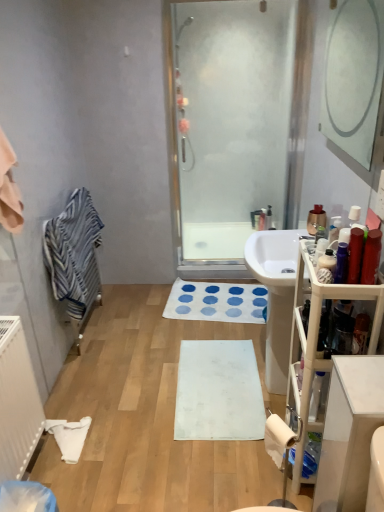
Looking at this image, measure the distance between clear glass mirror at upper right and camera.

The distance of clear glass mirror at upper right from camera is 3.00 meters.

Image resolution: width=384 pixels, height=512 pixels. What do you see at coordinates (74, 253) in the screenshot?
I see `blue striped towel at left` at bounding box center [74, 253].

This screenshot has width=384, height=512. Describe the element at coordinates (316, 219) in the screenshot. I see `gold metallic cup at right, the 5th toiletry when ordered from front to back` at that location.

What is the approximate height of gold metallic cup at right, the first toiletry positioned from the back?

gold metallic cup at right, the first toiletry positioned from the back, is 4.91 inches tall.

In order to face white matte rug at center, should I rotate leftwards or rightwards?

To face it directly, rotate left by 2.460 degrees.

What do you see at coordinates (148, 417) in the screenshot? I see `white matte rug at center` at bounding box center [148, 417].

You are a GUI agent. You are given a task and a screenshot of the screen. Output one action in this format:
    pyautogui.click(x=<x>, y=<y>)
    Task: Click on the white fabric bath mat at center, arranged as the first bath mat when viewed from the back
    Image resolution: width=384 pixels, height=512 pixels.
    Given the screenshot: What is the action you would take?
    pyautogui.click(x=216, y=302)

Identify the location of clear glass mirror at upper right. Image resolution: width=384 pixels, height=512 pixels. (353, 77).

What's the angular difference between white glossy sink at center and white matte bath mat at center, the second bath mat viewed from the top,'s facing directions?

They differ by 3.37 degrees in their facing directions.

Which object is more forward, white glossy sink at center or white matte bath mat at center, the second bath mat viewed from the top?

white glossy sink at center is more forward.

Between white glossy sink at center and white matte bath mat at center, which is counted as the 2th bath mat, starting from the back, which one has smaller size?

Smaller between the two is white matte bath mat at center, which is counted as the 2th bath mat, starting from the back.

Does white glossy sink at center turn towards white matte bath mat at center, the second bath mat viewed from the top?

Yes, white glossy sink at center is facing white matte bath mat at center, the second bath mat viewed from the top.

Consider the image. Is gold metallic cup at right, the first toiletry positioned from the back, positioned with its back to white glossy cabinet at right?

gold metallic cup at right, the first toiletry positioned from the back, does not have its back to white glossy cabinet at right.

Consider the image. Based on their positions, is gold metallic cup at right, the 5th toiletry when ordered from front to back, located to the left or right of white glossy cabinet at right?

gold metallic cup at right, the 5th toiletry when ordered from front to back, is positioned on white glossy cabinet at right's right side.

From a real-world perspective, is gold metallic cup at right, the first toiletry when ordered from right to left, positioned under white glossy cabinet at right based on gravity?

Incorrect, from a real-world perspective, gold metallic cup at right, the first toiletry when ordered from right to left, is higher than white glossy cabinet at right.

Is gold metallic cup at right, the first toiletry when ordered from right to left, inside or outside of white glossy cabinet at right?

gold metallic cup at right, the first toiletry when ordered from right to left, is spatially situated outside white glossy cabinet at right.

From a real-world perspective, which object stands above the other?

From a 3D spatial view, transparent glass shower door at center is above.

Would you say white matte toilet paper at lower right contains transparent glass shower door at center?

No, transparent glass shower door at center is located outside of white matte toilet paper at lower right.

Considering the relative positions of white matte toilet paper at lower right and transparent glass shower door at center in the image provided, is white matte toilet paper at lower right behind transparent glass shower door at center?

No, white matte toilet paper at lower right is in front of transparent glass shower door at center.

From the picture: From a real-world perspective, who is located higher, transparent glass shower door at center or white glossy sink at center?

transparent glass shower door at center, from a real-world perspective.

Which of these two, transparent glass shower door at center or white glossy sink at center, is smaller?

With smaller size is transparent glass shower door at center.

Who is taller, transparent glass shower door at center or white glossy sink at center?

Standing taller between the two is transparent glass shower door at center.

Considering the positions of objects transparent glass shower door at center and white glossy sink at center in the image provided, who is more to the right, transparent glass shower door at center or white glossy sink at center?

From the viewer's perspective, white glossy sink at center appears more on the right side.

Identify the location of toilet paper above the white radiator at lower left (from the image's perspective). (278, 438).

Does white radiator at lower left appear on the right side of white matte toilet paper at lower right?

Incorrect, white radiator at lower left is not on the right side of white matte toilet paper at lower right.

From a real-world perspective, is white radiator at lower left positioned over white matte toilet paper at lower right based on gravity?

Actually, white radiator at lower left is physically below white matte toilet paper at lower right in the real world.

Which of these two, white radiator at lower left or white matte toilet paper at lower right, is smaller?

With smaller size is white matte toilet paper at lower right.

Based on their positions, is clear glass mirror at upper right located to the left or right of shiny purple bottle at right, the third toiletry viewed from the back?

clear glass mirror at upper right is to the right of shiny purple bottle at right, the third toiletry viewed from the back.

Is clear glass mirror at upper right looking in the opposite direction of shiny purple bottle at right, the 3th toiletry positioned from the front?

That's not correct — clear glass mirror at upper right is not looking away from shiny purple bottle at right, the 3th toiletry positioned from the front.

Image resolution: width=384 pixels, height=512 pixels. I want to click on bath above the blue striped towel at left (from the image's perspective), so click(215, 240).

Can you confirm if blue striped towel at left is shorter than translucent glass bathtub at center?

No.

Does blue striped towel at left lie behind translucent glass bathtub at center?

No.

Is blue striped towel at left inside or outside of translucent glass bathtub at center?

blue striped towel at left is outside translucent glass bathtub at center.

Find the location of a particular element. Image resolution: width=384 pixels, height=512 pixels. sink that appears in front of the white matte bath mat at center, which is counted as the 2th bath mat, starting from the back is located at coordinates (276, 296).

I want to click on bathroom cabinet that is on the left side of gold metallic cup at right, the first toiletry when ordered from right to left, so click(349, 432).

Which object lies further to the anchor point white matte bath mat at center, which is counted as the 2th bath mat, starting from the back, shiny red bottle at right, the 3th toiletry when ordered from right to left, or white matte rug at center?

Based on the image, shiny red bottle at right, the 3th toiletry when ordered from right to left, appears to be further to white matte bath mat at center, which is counted as the 2th bath mat, starting from the back.

Looking at the image, which one is located further to shiny red bottle at right, the 3th toiletry when ordered from right to left, white plastic vanity at right or white matte rug at center?

Among the two, white matte rug at center is located further to shiny red bottle at right, the 3th toiletry when ordered from right to left.

Based on the photo, considering their positions, is white matte rug at center positioned further to white plastic vanity at right than shiny plastic bottle at right, the 4th toiletry from the front?

white matte rug at center is positioned further to the anchor white plastic vanity at right.

When comparing their distances from white matte bath mat at center, which is the 1th bath mat in front-to-back order, does white plastic vanity at right or transparent glass shower door at center seem closer?

Among the two, white plastic vanity at right is located nearer to white matte bath mat at center, which is the 1th bath mat in front-to-back order.

Estimate the real-world distances between objects in this image. Which object is closer to white plastic vanity at right, blue striped towel at left or white glossy cabinet at right?

Among the two, white glossy cabinet at right is located nearer to white plastic vanity at right.

Looking at the image, which one is located closer to white matte bath mat at center, the second bath mat viewed from the top, white matte toilet paper at lower right or matte silver faucet at center?

Among the two, white matte toilet paper at lower right is located nearer to white matte bath mat at center, the second bath mat viewed from the top.

Estimate the real-world distances between objects in this image. Which object is closer to white glossy cabinet at right, shiny red bottle at right, marked as the 4th toiletry in a back-to-front arrangement, or white plastic vanity at right?

white plastic vanity at right is positioned closer to the anchor white glossy cabinet at right.

When comparing their distances from white matte rug at center, does white matte toilet paper at lower right or clear glass mirror at upper right seem closer?

Based on the image, white matte toilet paper at lower right appears to be nearer to white matte rug at center.

The image size is (384, 512). What are the coordinates of `sink between white plastic vanity at right and matte silver faucet at center along the z-axis` in the screenshot? It's located at (276, 296).

Identify the location of vanity between shiny red bottle at right, marked as the 4th toiletry in a back-to-front arrangement, and white fabric bath mat at center, the second bath mat in the bottom-to-top sequence, along the z-axis. (317, 343).

You are a GUI agent. You are given a task and a screenshot of the screen. Output one action in this format:
    pyautogui.click(x=<x>, y=<y>)
    Task: Click on the plain between shiny purple bottle at right, marked as the 4th toiletry in a right-to-left arrangement, and white fabric bath mat at center, the second bath mat in the bottom-to-top sequence, from front to back
    This screenshot has width=384, height=512.
    Given the screenshot: What is the action you would take?
    pyautogui.click(x=148, y=417)

Locate an element on the screen. This screenshot has width=384, height=512. sink between clear glass mirror at upper right and white fabric bath mat at center, arranged as the first bath mat when viewed from the back, along the z-axis is located at coordinates (276, 296).